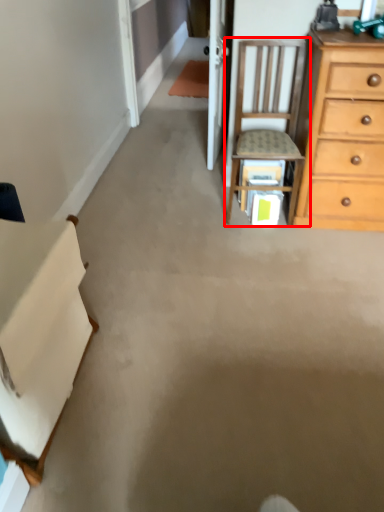
Question: In this image, where is chair (annotated by the red box) located relative to cabinetry?

Choices:
 (A) right
 (B) left

Answer: (A)